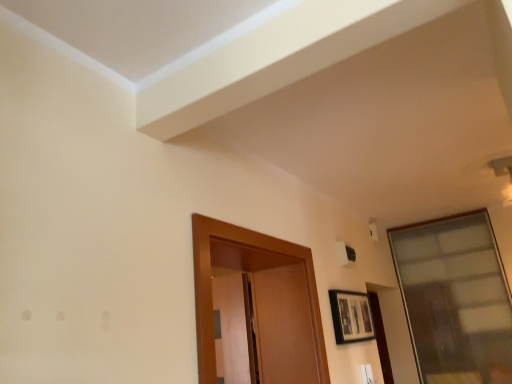
Question: Visually, is transparent glass window at upper right positioned to the left or to the right of matte black picture frame at lower right?

Choices:
 (A) right
 (B) left

Answer: (A)

Question: Is transparent glass window at upper right in front of or behind matte black picture frame at lower right in the image?

Choices:
 (A) front
 (B) behind

Answer: (B)

Question: In terms of width, does transparent glass window at upper right look wider or thinner when compared to matte black picture frame at lower right?

Choices:
 (A) wide
 (B) thin

Answer: (A)

Question: Relative to transparent glass window at upper right, is matte black picture frame at lower right in front or behind?

Choices:
 (A) behind
 (B) front

Answer: (B)

Question: Based on their positions, is matte black picture frame at lower right located to the left or right of transparent glass window at upper right?

Choices:
 (A) right
 (B) left

Answer: (B)

Question: Is point (373, 324) closer or farther from the camera than point (500, 264)?

Choices:
 (A) closer
 (B) farther

Answer: (A)

Question: From their relative heights in the image, would you say matte black picture frame at lower right is taller or shorter than transparent glass window at upper right?

Choices:
 (A) tall
 (B) short

Answer: (B)